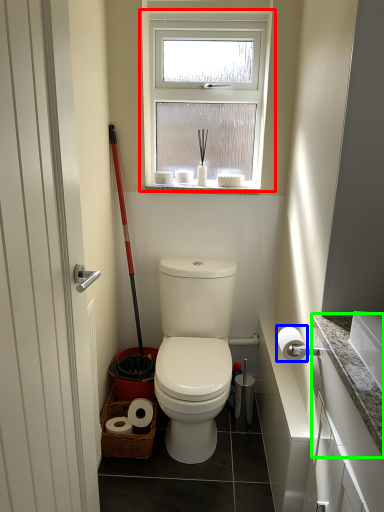
Question: Estimate the real-world distances between objects in this image. Which object is closer to window (highlighted by a red box), toilet paper (highlighted by a blue box) or counter top (highlighted by a green box)?

Choices:
 (A) toilet paper
 (B) counter top

Answer: (A)